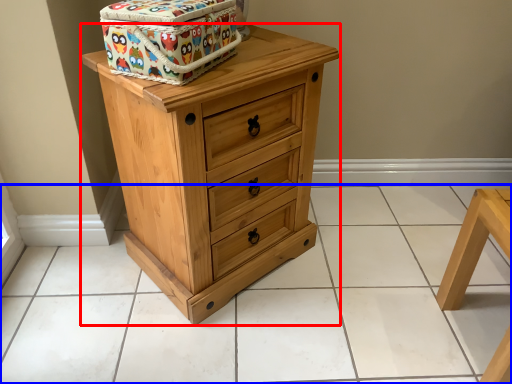
Question: Which object appears farthest to the camera in this image, chest of drawers (highlighted by a red box) or tile (highlighted by a blue box)?

Choices:
 (A) chest of drawers
 (B) tile

Answer: (B)